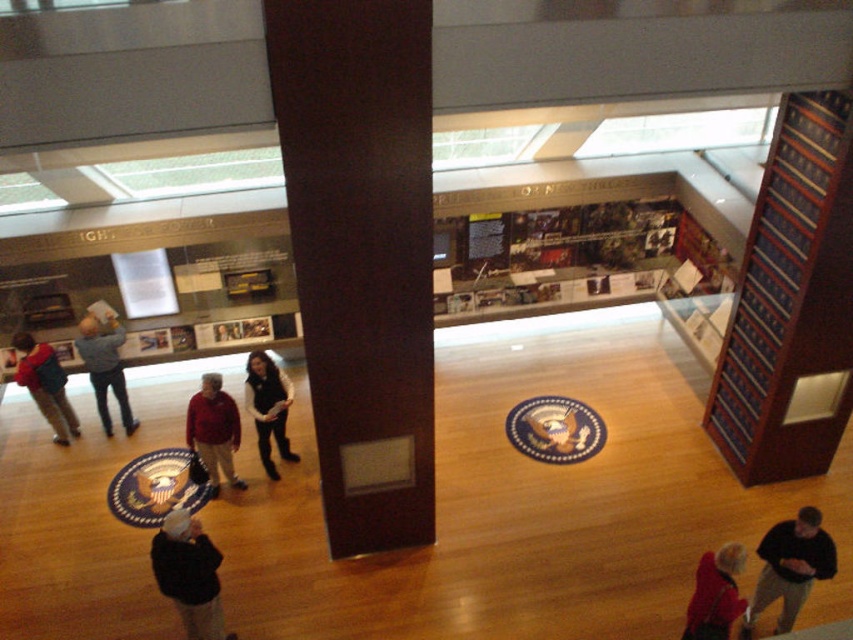
You are a fashion designer observing a museum exhibit and notice two garments displayed nearby. The velvet black vest at center and the gray sweater at left. Which garment has a shorter length?

The velvet black vest at center is shorter than the gray sweater at left.

Based on the photo, you are standing at the point marked as point (258, 422) in the museum. The nearest exit is 7.09 meters away. If you walk straight towards the exit, will you pass by the large dark pillar in the foreground?

The distance between you and the exit is 7.09 meters. Since the large dark pillar is in the foreground and directly in your path, you will have to go around it rather than walking straight through. Therefore, walking straight towards the exit will require navigating around the large dark pillar in the foreground.